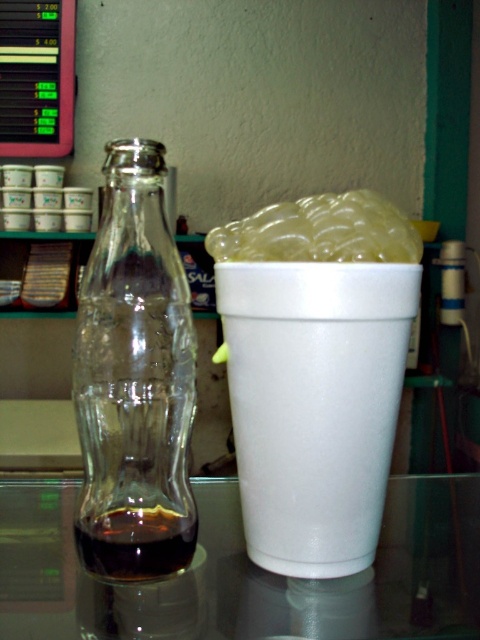
Is transparent glass bottle at left positioned behind translucent gelatinous substance at upper center?

No.

Can you confirm if transparent glass bottle at left is positioned to the right of translucent gelatinous substance at upper center?

No, transparent glass bottle at left is not to the right of translucent gelatinous substance at upper center.

Is point (166, 349) less distant than point (263, 220)?

Yes, it is.

This screenshot has width=480, height=640. What are the coordinates of `transparent glass bottle at left` in the screenshot? It's located at (134, 380).

Is transparent glass bottle at left smaller than dark brown liquid at bottle left?

No, transparent glass bottle at left is not smaller than dark brown liquid at bottle left.

Is point (118, 264) positioned behind point (155, 529)?

No, it is not.

In order to click on transparent glass bottle at left in this screenshot , I will do `click(134, 380)`.

Consider the image. Between transparent glass table at center and translucent gelatinous substance at upper center, which one is positioned lower?

Positioned lower is transparent glass table at center.

Between point (36, 484) and point (348, 257), which one is positioned behind?

The point (36, 484) is behind.

The height and width of the screenshot is (640, 480). I want to click on transparent glass table at center, so click(244, 573).